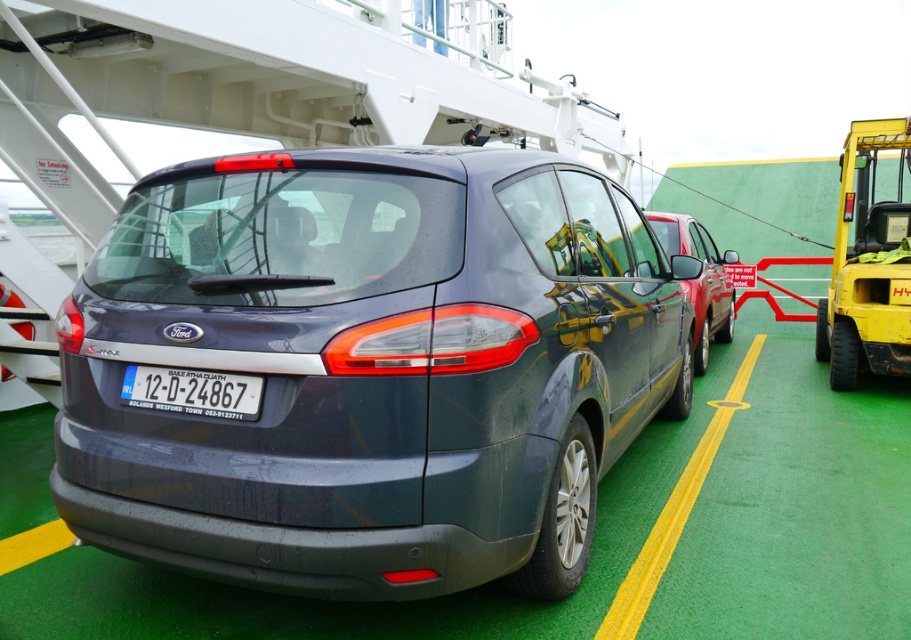
Does satin dark gray car at center lie in front of yellow rubber tire at right?

Yes, satin dark gray car at center is closer to the viewer.

Between satin dark gray car at center and yellow rubber tire at right, which one has more height?

Standing taller between the two is yellow rubber tire at right.

Who is more forward, (261,172) or (871,268)?

Point (261,172) is more forward.

At what (x,y) coordinates should I click in order to perform the action: click on satin dark gray car at center. Please return your answer as a coordinate pair (x, y). Looking at the image, I should click on (369, 369).

Is point (463, 372) closer to camera compared to point (694, 349)?

Yes.

From the picture: How far apart are satin dark gray car at center and metallic red car at center?

satin dark gray car at center is 4.19 meters from metallic red car at center.

This screenshot has height=640, width=911. Find the location of `satin dark gray car at center`. satin dark gray car at center is located at coordinates (369, 369).

Which is above, yellow rubber tire at right or white plastic license plate at center?

yellow rubber tire at right is higher up.

Is point (840, 275) positioned in front of point (128, 390)?

No.

Identify the location of yellow rubber tire at right. (868, 262).